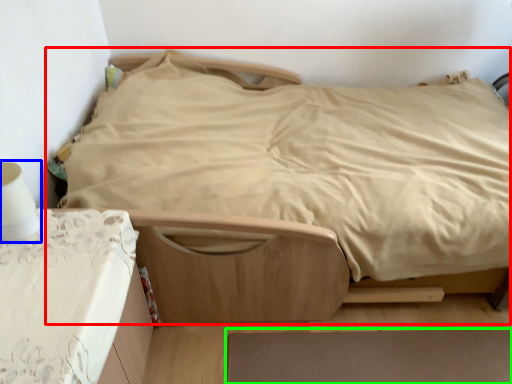
Question: Based on their relative distances, which object is nearer to bed (highlighted by a red box)? Choose from table lamp (highlighted by a blue box) and plain (highlighted by a green box).

Choices:
 (A) table lamp
 (B) plain

Answer: (B)